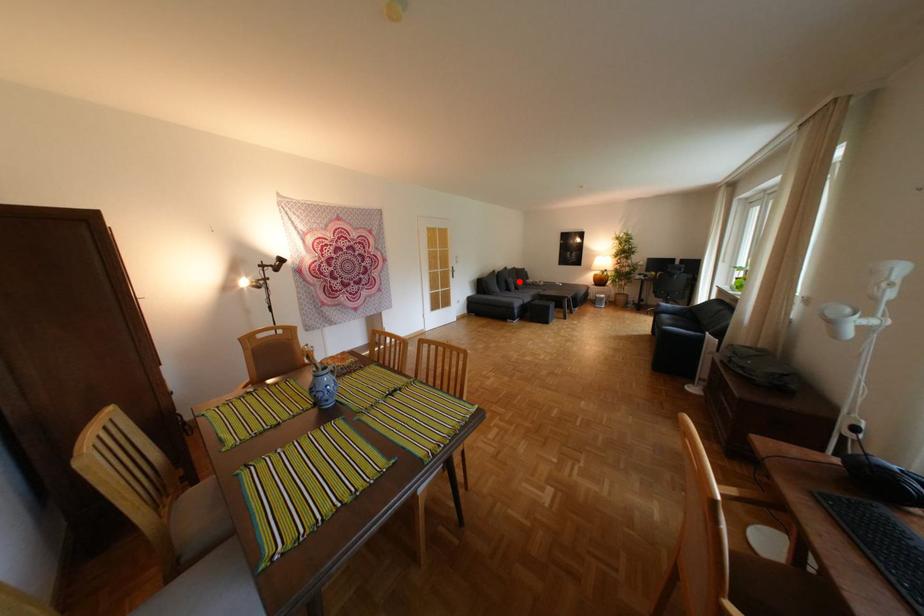
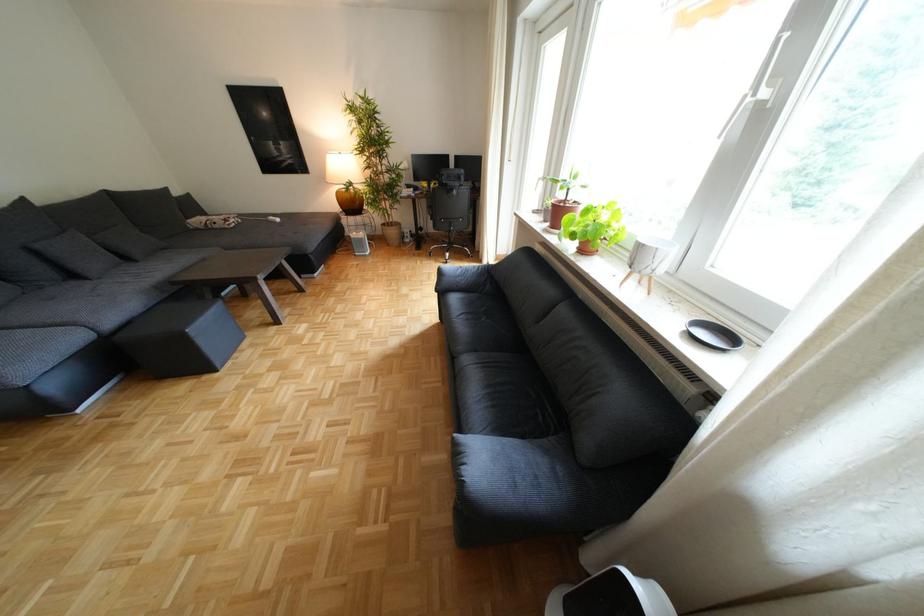
Locate, in the second image, the point that corresponds to the highlighted location in the first image.

(49, 253)